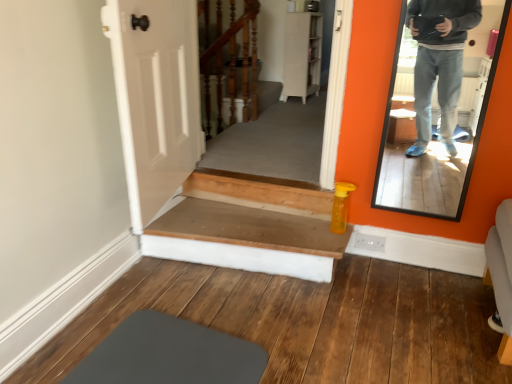
The width and height of the screenshot is (512, 384). Find the location of `free spot to the right of wooden stairs at center`. free spot to the right of wooden stairs at center is located at coordinates (410, 303).